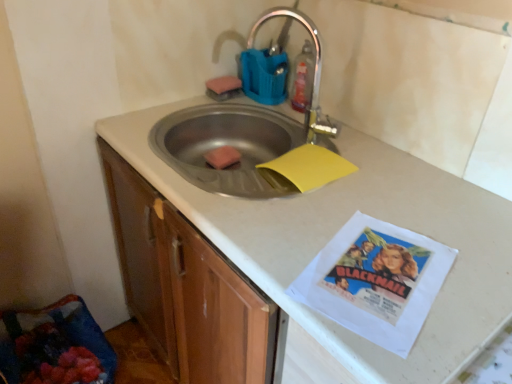
Identify the location of free spot to the left of yellow matte paper at sink. (238, 183).